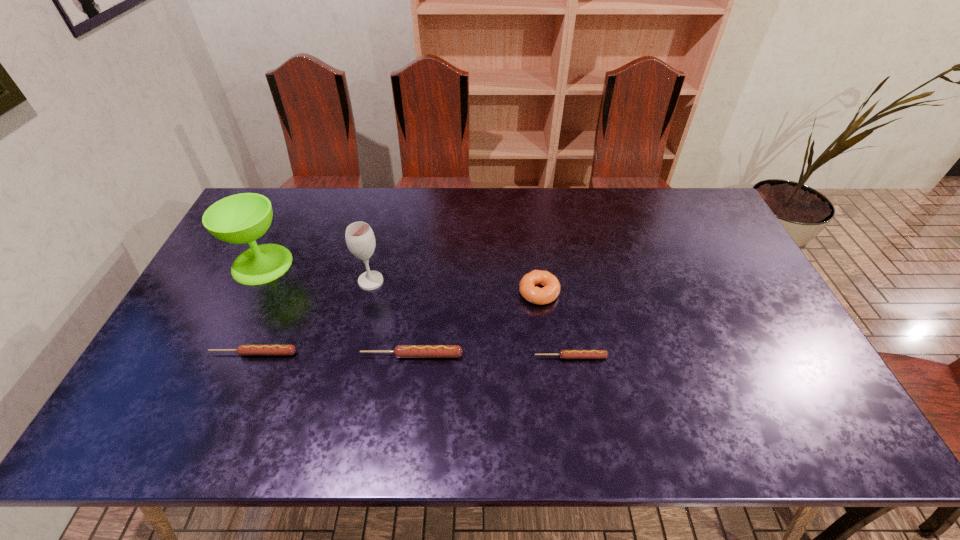
In the image, there is a desktop. Find the location of `free space at the far right corner`. free space at the far right corner is located at coordinates (684, 192).

The image size is (960, 540). In the image, there is a desktop. In order to click on free space at the near right corner in this screenshot , I will do `click(801, 379)`.

In order to click on empty space that is in between the shortest sausage and the fourth shortest object in this screenshot , I will do `click(555, 325)`.

The height and width of the screenshot is (540, 960). What are the coordinates of `vacant area that lies between the right wineglass and the shortest object` in the screenshot? It's located at (470, 319).

Where is `free point between the left wineglass and the second shortest sausage`? free point between the left wineglass and the second shortest sausage is located at coordinates (258, 308).

In order to click on free spot between the left wineglass and the doughnut in this screenshot , I will do `click(400, 278)`.

The image size is (960, 540). In order to click on vacant space in between the second shortest object and the second sausage from right to left in this screenshot , I will do `click(333, 354)`.

What are the coordinates of `free space between the right wineglass and the left wineglass` in the screenshot? It's located at (317, 273).

Identify the location of free area in between the right wineglass and the shortest sausage. (470, 319).

The image size is (960, 540). Identify the location of vacant region between the rightmost sausage and the left wineglass. (417, 310).